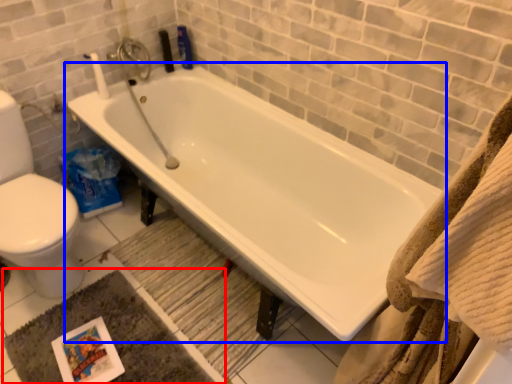
Question: Which object is closer to the camera taking this photo, bath mat (highlighted by a red box) or bathtub (highlighted by a blue box)?

Choices:
 (A) bath mat
 (B) bathtub

Answer: (B)